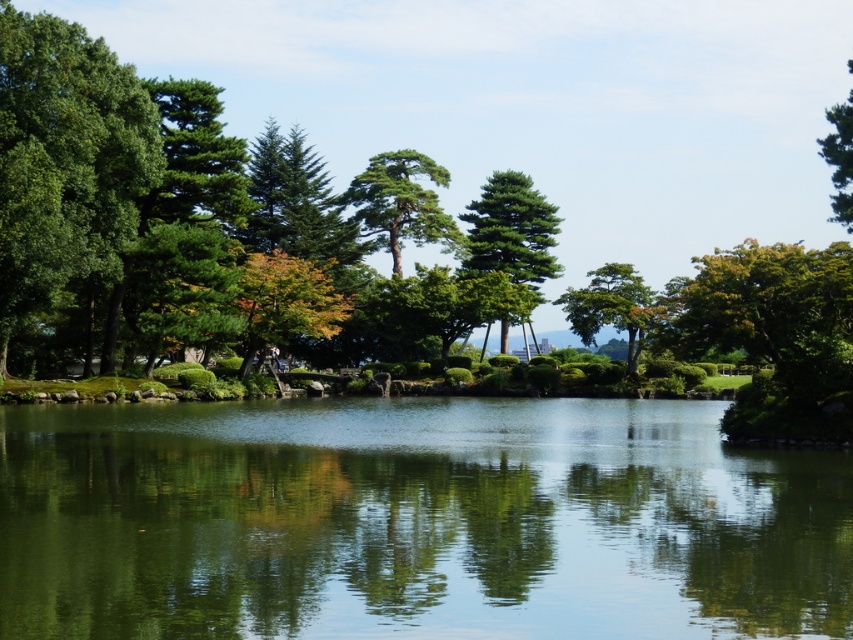
You are standing at the point marked as point (415,522) in the image. What is the closest object to you in the scene?

The green reflective water at center is located at point (415,522), so the closest object to you is the green reflective water at center.

You are standing on the wooden bridge and see the green reflective water at center and the green glossy tree at center. Which object is positioned to the left of the other?

The green reflective water at center is to the left of the green glossy tree at center.